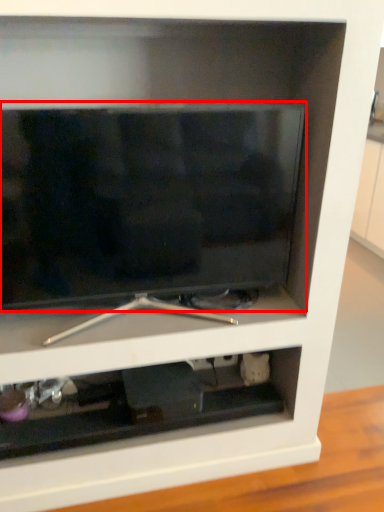
Question: Observing the image, what is the correct spatial positioning of television (annotated by the red box) in reference to cabinet?

Choices:
 (A) right
 (B) left

Answer: (A)